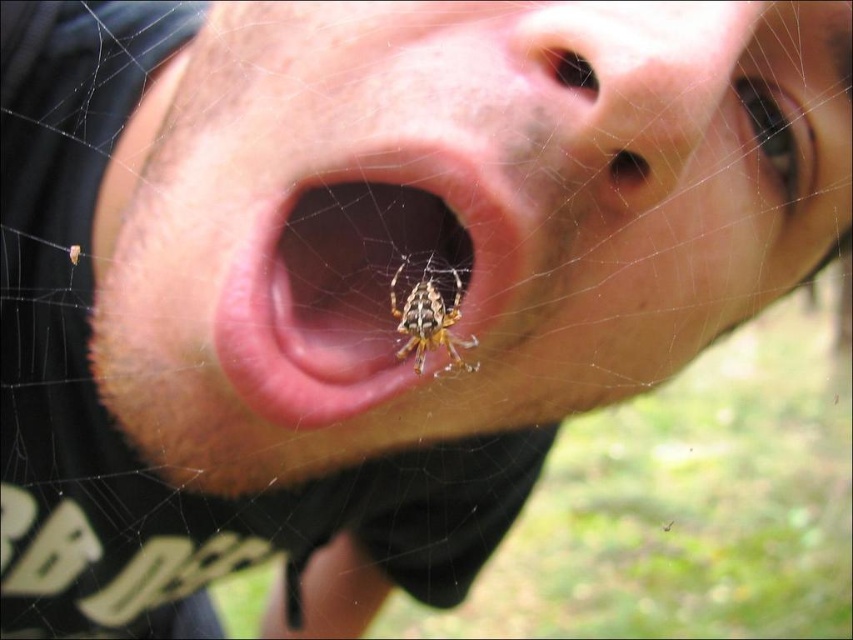
Can you confirm if pink matte/object at center is positioned to the right of smooth skin nose at center?

No, pink matte/object at center is not to the right of smooth skin nose at center.

Is pink matte/object at center taller than smooth skin nose at center?

Correct, pink matte/object at center is much taller as smooth skin nose at center.

Find the location of `pink matte/object at center`. pink matte/object at center is located at coordinates coord(352,272).

The height and width of the screenshot is (640, 853). Identify the location of pink matte/object at center. (352, 272).

Does pink matte/object at center appear over shiny brown spider at mouth center?

Yes, pink matte/object at center is above shiny brown spider at mouth center.

You are a GUI agent. You are given a task and a screenshot of the screen. Output one action in this format:
    pyautogui.click(x=<x>, y=<y>)
    Task: Click on the pink matte/object at center
    Image resolution: width=853 pixels, height=640 pixels.
    Given the screenshot: What is the action you would take?
    pyautogui.click(x=352, y=272)

The width and height of the screenshot is (853, 640). What do you see at coordinates (352, 272) in the screenshot?
I see `pink matte/object at center` at bounding box center [352, 272].

Locate an element on the screen. The width and height of the screenshot is (853, 640). pink matte/object at center is located at coordinates (352, 272).

Is point (608, 90) in front of point (428, 278)?

Yes, point (608, 90) is closer to viewer.

Can you confirm if smooth skin nose at center is positioned to the right of shiny brown spider at mouth center?

Indeed, smooth skin nose at center is positioned on the right side of shiny brown spider at mouth center.

Identify the location of smooth skin nose at center. This screenshot has height=640, width=853. (634, 84).

Identify the location of smooth skin nose at center. (634, 84).